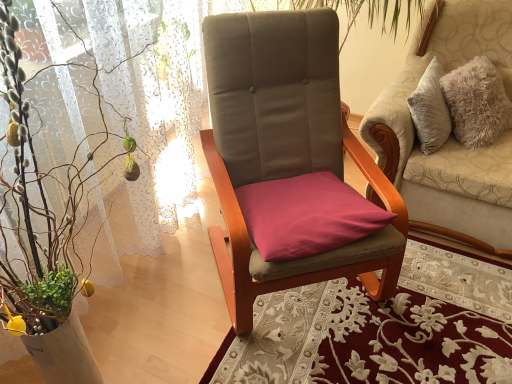
Question: Is green leafy plant at left directly adjacent to velvet beige chair at center, the 2th chair from the left?

Choices:
 (A) no
 (B) yes

Answer: (A)

Question: Is the depth of green leafy plant at left greater than that of velvet beige chair at center, positioned as the first chair in right-to-left order?

Choices:
 (A) no
 (B) yes

Answer: (A)

Question: Could you tell me if green leafy plant at left is turned towards velvet beige chair at center, the 2th chair from the left?

Choices:
 (A) yes
 (B) no

Answer: (B)

Question: From a real-world perspective, is green leafy plant at left physically above velvet beige chair at center, the 2th chair from the left?

Choices:
 (A) yes
 (B) no

Answer: (A)

Question: Is green leafy plant at left not near velvet beige chair at center, positioned as the first chair in right-to-left order?

Choices:
 (A) no
 (B) yes

Answer: (B)

Question: Would you say green leafy plant at left contains velvet beige chair at center, positioned as the first chair in right-to-left order?

Choices:
 (A) yes
 (B) no

Answer: (B)

Question: Is green leafy plant at left taller than purple fabric cushion at center?

Choices:
 (A) yes
 (B) no

Answer: (A)

Question: Does green leafy plant at left contain purple fabric cushion at center?

Choices:
 (A) yes
 (B) no

Answer: (B)

Question: From the image's perspective, does green leafy plant at left appear lower than purple fabric cushion at center?

Choices:
 (A) no
 (B) yes

Answer: (B)

Question: Is green leafy plant at left aimed at purple fabric cushion at center?

Choices:
 (A) yes
 (B) no

Answer: (B)

Question: Are green leafy plant at left and purple fabric cushion at center far apart?

Choices:
 (A) yes
 (B) no

Answer: (B)

Question: Is green leafy plant at left closer to camera compared to purple fabric cushion at center?

Choices:
 (A) no
 (B) yes

Answer: (B)

Question: From the image's perspective, is purple fabric cushion at center located beneath green leafy plant at left?

Choices:
 (A) yes
 (B) no

Answer: (B)